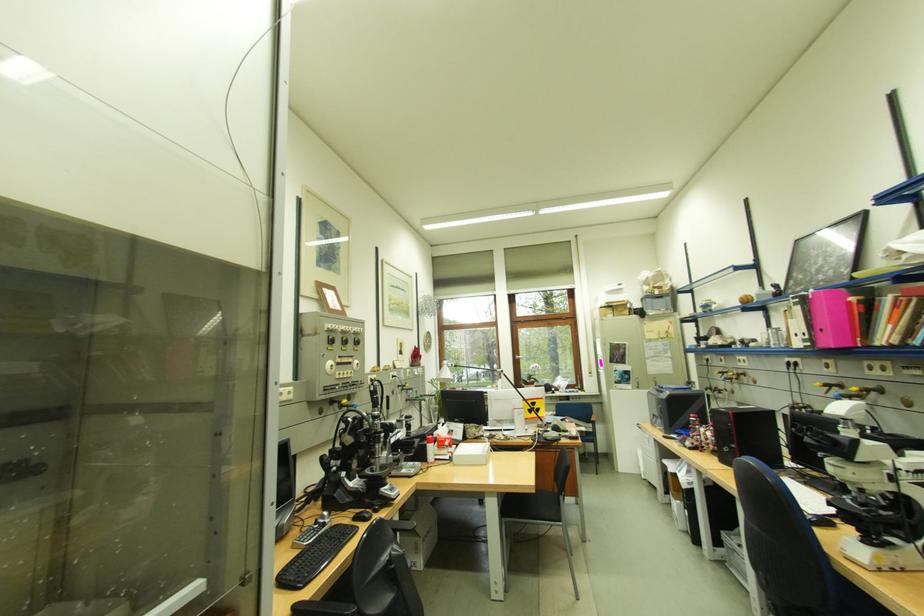
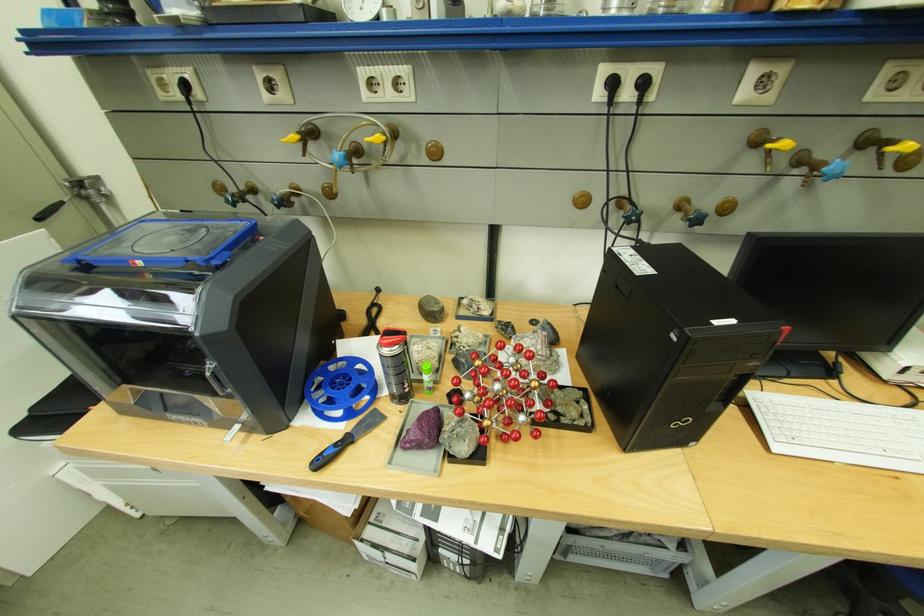
The point at (804, 368) is marked in the first image. Where is the corresponding point in the second image?

(638, 95)